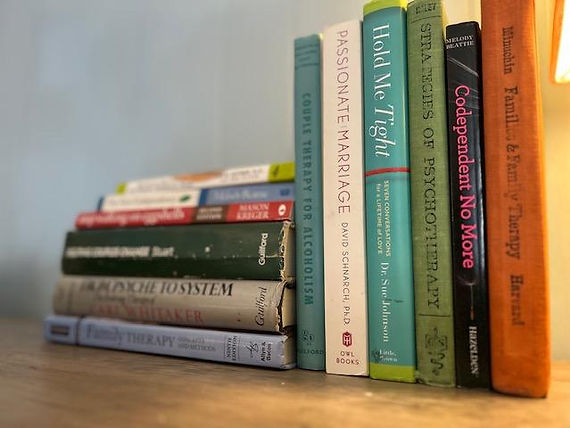
At what (x,y) coordinates should I click in order to perform the action: click on books standing up. Please return your answer as a coordinate pair (x, y). The image size is (570, 428). Looking at the image, I should click on (307, 184), (331, 195), (372, 219), (414, 230), (470, 230), (507, 231).